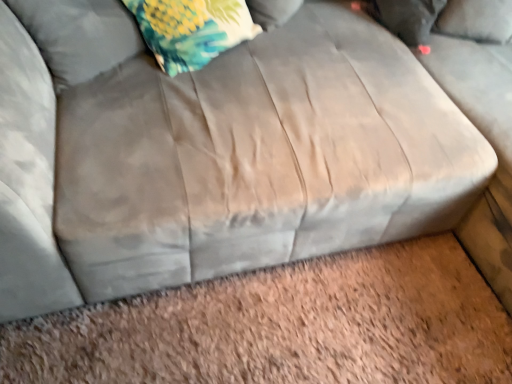
Question: Can we say floral fabric pillow at upper left, marked as the second pillow in a left-to-right arrangement, lies outside fluffy fabric pillow at upper left, the 2th pillow from the back?

Choices:
 (A) yes
 (B) no

Answer: (A)

Question: Is floral fabric pillow at upper left, the 1th pillow from the right, thinner than fluffy fabric pillow at upper left, the 2th pillow from the back?

Choices:
 (A) yes
 (B) no

Answer: (A)

Question: Could you tell me if floral fabric pillow at upper left, the 1th pillow from the right, is turned towards fluffy fabric pillow at upper left, the 2th pillow from the back?

Choices:
 (A) no
 (B) yes

Answer: (A)

Question: Is the depth of floral fabric pillow at upper left, positioned as the 2th pillow in front-to-back order, greater than that of fluffy fabric pillow at upper left, the 1th pillow positioned from the left?

Choices:
 (A) no
 (B) yes

Answer: (B)

Question: Does floral fabric pillow at upper left, positioned as the 2th pillow in front-to-back order, have a smaller size compared to fluffy fabric pillow at upper left, the 1th pillow positioned from the left?

Choices:
 (A) no
 (B) yes

Answer: (B)

Question: Is floral fabric pillow at upper left taller or shorter than fluffy fabric pillow at upper left, which appears as the first pillow when viewed from the front?

Choices:
 (A) tall
 (B) short

Answer: (A)

Question: From the image's perspective, is floral fabric pillow at upper left located above or below fluffy fabric pillow at upper left, which appears as the first pillow when viewed from the front?

Choices:
 (A) below
 (B) above

Answer: (B)

Question: From a real-world perspective, relative to fluffy fabric pillow at upper left, which appears as the first pillow when viewed from the front, is floral fabric pillow at upper left vertically above or below?

Choices:
 (A) above
 (B) below

Answer: (A)

Question: Considering their positions, is floral fabric pillow at upper left located in front of or behind fluffy fabric pillow at upper left, the 2th pillow from the back?

Choices:
 (A) front
 (B) behind

Answer: (B)

Question: Looking at their shapes, would you say floral fabric pillow at upper left, the 1th pillow from the right, is wider or thinner than floral fabric pillow at upper left?

Choices:
 (A) wide
 (B) thin

Answer: (B)

Question: Relative to floral fabric pillow at upper left, is floral fabric pillow at upper left, placed as the 1th pillow when sorted from back to front, in front or behind?

Choices:
 (A) front
 (B) behind

Answer: (B)

Question: Based on their sizes in the image, would you say floral fabric pillow at upper left, placed as the 1th pillow when sorted from back to front, is bigger or smaller than floral fabric pillow at upper left?

Choices:
 (A) big
 (B) small

Answer: (B)

Question: From the image's perspective, is floral fabric pillow at upper left, positioned as the 2th pillow in front-to-back order, positioned above or below floral fabric pillow at upper left?

Choices:
 (A) above
 (B) below

Answer: (A)

Question: Is floral fabric pillow at upper left wider or thinner than floral fabric pillow at upper left, the 1th pillow from the right?

Choices:
 (A) thin
 (B) wide

Answer: (B)

Question: Considering their positions, is floral fabric pillow at upper left located in front of or behind floral fabric pillow at upper left, positioned as the 2th pillow in front-to-back order?

Choices:
 (A) front
 (B) behind

Answer: (A)